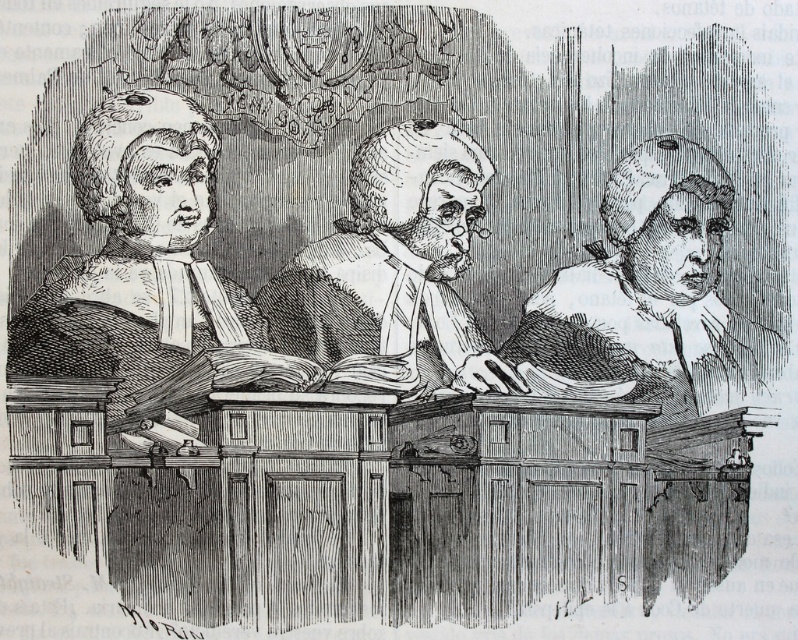
Measure the distance between smooth gray wig at center and smooth parchment document at center.

A distance of 4.40 meters exists between smooth gray wig at center and smooth parchment document at center.

Which is in front, point (646, 157) or point (423, 340)?

Point (423, 340) is in front.

Is point (597, 348) more distant than point (315, 339)?

Yes, point (597, 348) is farther from viewer.

Identify the location of smooth gray wig at center. (648, 296).

Which of these two, matte black wig at center or smooth parchment document at center, stands shorter?

smooth parchment document at center is shorter.

Can you confirm if matte black wig at center is positioned above smooth parchment document at center?

Correct, matte black wig at center is located above smooth parchment document at center.

Is point (121, 336) less distant than point (433, 323)?

That is True.

Where is `matte black wig at center`? matte black wig at center is located at coordinates (137, 253).

Does point (214, 321) come behind point (721, 204)?

No, it is not.

Based on the photo, can you confirm if matte black wig at center is positioned below smooth gray wig at center?

Incorrect, matte black wig at center is not positioned below smooth gray wig at center.

Where is `matte black wig at center`? This screenshot has height=640, width=798. matte black wig at center is located at coordinates coord(137,253).